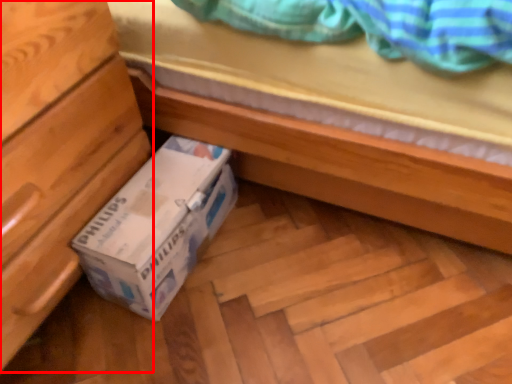
Question: From the image, what is the correct spatial relationship of chest of drawers (annotated by the red box) in relation to box?

Choices:
 (A) right
 (B) left

Answer: (B)